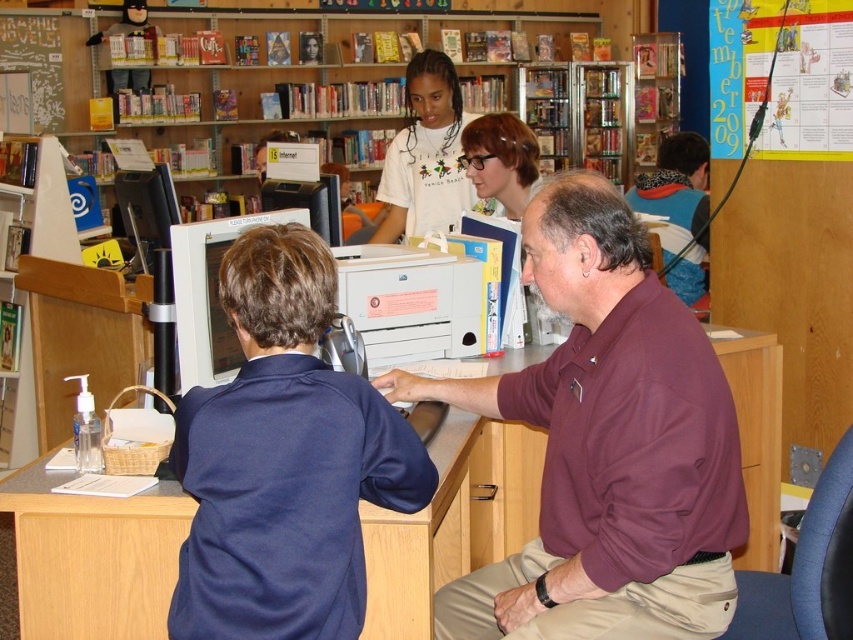
Question: Which object is farther from the camera taking this photo?

Choices:
 (A) wooden bookshelf at upper center
 (B) maroon shirt at center
 (C) wooden desk at center
 (D) orange knit sweater at upper right

Answer: (A)

Question: Which is farther from the white cotton shirt at center?

Choices:
 (A) orange knit sweater at upper right
 (B) matte white monitor at center
 (C) blue fabric shirt at center
 (D) wooden desk at center

Answer: (C)

Question: Among these objects, which one is farthest from the camera?

Choices:
 (A) matte white monitor at center
 (B) orange knit sweater at upper right

Answer: (B)

Question: Is white cotton shirt at center above wooden bookshelf at upper center?

Choices:
 (A) no
 (B) yes

Answer: (A)

Question: From the image, what is the correct spatial relationship of maroon shirt at center in relation to blue fabric shirt at center?

Choices:
 (A) right
 (B) left

Answer: (A)

Question: Is blue fabric shirt at center closer to camera compared to white cotton shirt at center?

Choices:
 (A) yes
 (B) no

Answer: (A)